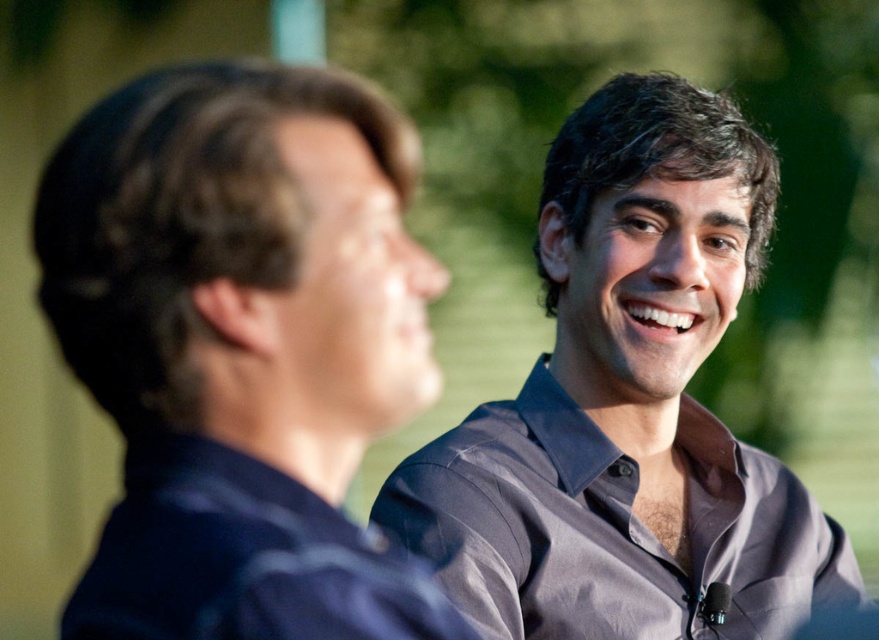
You are a photographer standing between two people in the image. The person on the left is wearing a dark blue shirt at left, and the person on the right has a small microphone clipped to their shirt. You need to adjust your position so that both subjects are in focus. Given that your camera has a depth of field that can sharply focus on subjects within a 1.0 meter range, can you achieve this without moving the subjects?

The two individuals are 1.12 meters apart. Since the camera can only sharply focus within a 1.0 meter range, the distance between them exceeds the depth of field capability. Therefore, you cannot achieve sharp focus on both subjects simultaneously without moving them.

You are standing in the same location as the photographer. Which of the two points, point [318,244] or point [670,417], is closer to you?

Point [318,244] is closer to you because it is in front of point [670,417].